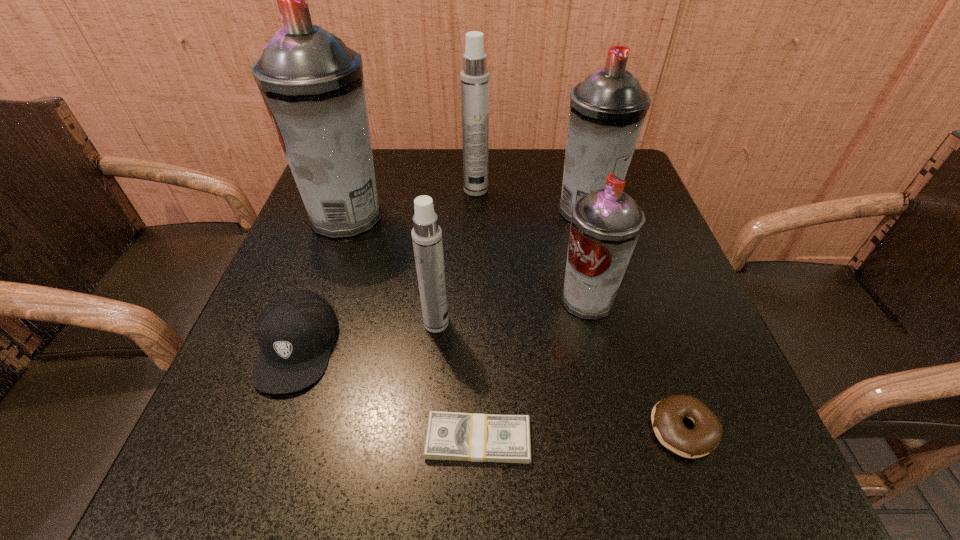
Locate an element on the screen. This screenshot has height=540, width=960. the biggest gray aerosol can is located at coordinates (312, 84).

You are a GUI agent. You are given a task and a screenshot of the screen. Output one action in this format:
    pyautogui.click(x=<x>, y=<y>)
    Task: Click on the leftmost aerosol can
    The height and width of the screenshot is (540, 960).
    Given the screenshot: What is the action you would take?
    pyautogui.click(x=312, y=84)

Locate an element on the screen. This screenshot has width=960, height=540. the second smallest gray aerosol can is located at coordinates (607, 110).

Where is `the right white aerosol can`? the right white aerosol can is located at coordinates (474, 77).

Locate an element on the screen. This screenshot has width=960, height=540. the bigger white aerosol can is located at coordinates (474, 77).

In order to click on the smallest gray aerosol can in this screenshot , I will do `click(606, 223)`.

Where is `the nearer white aerosol can`? The width and height of the screenshot is (960, 540). the nearer white aerosol can is located at coordinates (426, 234).

You are a GUI agent. You are given a task and a screenshot of the screen. Output one action in this format:
    pyautogui.click(x=<x>, y=<y>)
    Task: Click on the smaller white aerosol can
    Image resolution: width=960 pixels, height=540 pixels.
    Given the screenshot: What is the action you would take?
    pyautogui.click(x=426, y=234)

Identify the location of the sixth tallest object. The height and width of the screenshot is (540, 960). (295, 331).

The image size is (960, 540). Identify the location of brown doughnut. (667, 415).